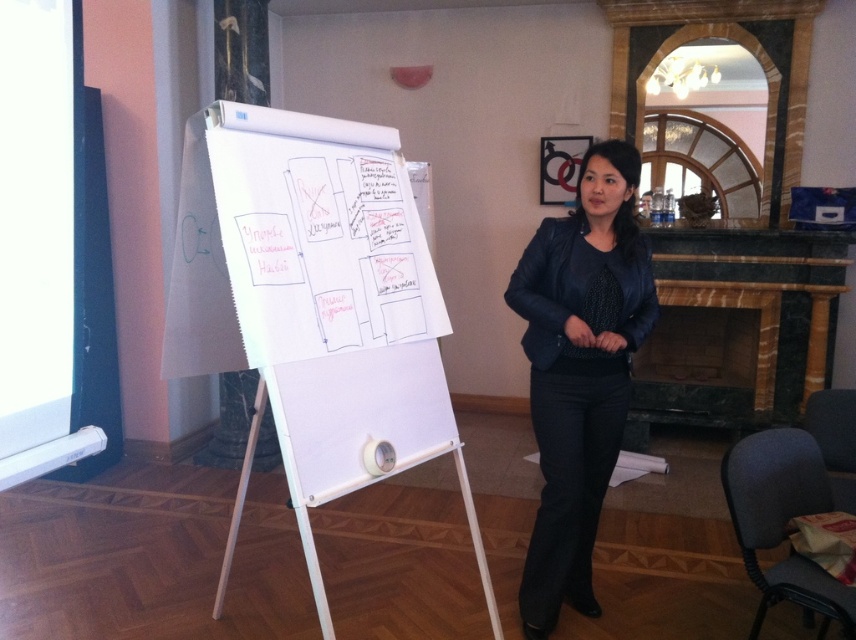
Question: In this image, where is white paperboard at center located relative to matte black jacket at center?

Choices:
 (A) right
 (B) left

Answer: (B)

Question: Does white paperboard at center appear under matte black jacket at center?

Choices:
 (A) yes
 (B) no

Answer: (A)

Question: Can you confirm if white paperboard at center is bigger than matte black jacket at center?

Choices:
 (A) no
 (B) yes

Answer: (B)

Question: Which point appears farthest from the camera in this image?

Choices:
 (A) (610, 352)
 (B) (397, 298)

Answer: (A)